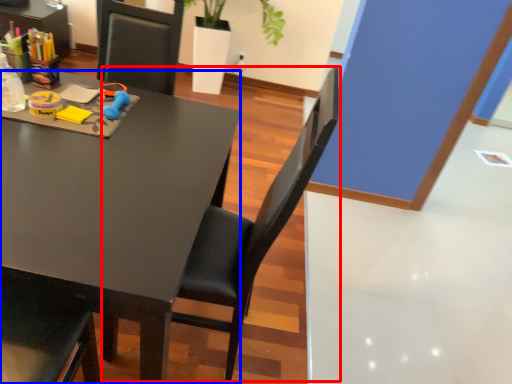
Question: Which point is further to the camera, chair (highlighted by a red box) or desk (highlighted by a blue box)?

Choices:
 (A) chair
 (B) desk

Answer: (B)